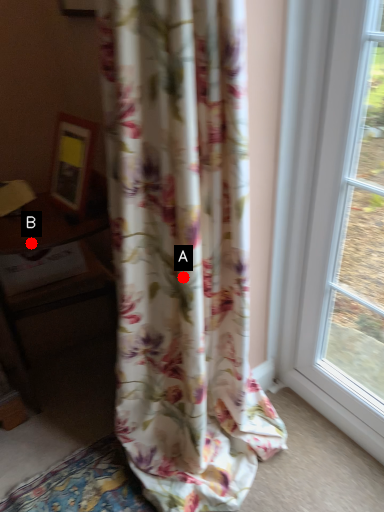
Question: Two points are circled on the image, labeled by A and B beside each circle. Which point is farther from the camera taking this photo?

Choices:
 (A) A is further
 (B) B is further

Answer: (B)